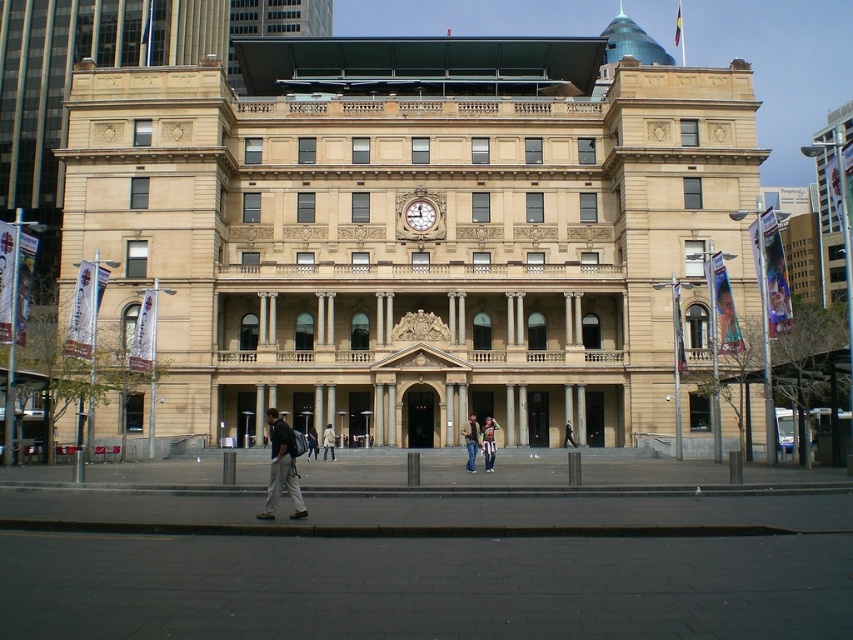
Question: In this image, where is dark gray fabric pants at lower left located relative to striped fabric pants at center?

Choices:
 (A) above
 (B) below

Answer: (A)

Question: Which point is closer to the camera?

Choices:
 (A) dark suit at center
 (B) shiny glass dome at upper center
 (C) striped fabric pants at center
 (D) gold metallic clock at center

Answer: (C)

Question: Which of the following is the farthest from the observer?

Choices:
 (A) denim jacket at center
 (B) light brown leather jacket at center

Answer: (B)

Question: Which object appears farthest from the camera in this image?

Choices:
 (A) striped fabric pants at center
 (B) dark gray fabric pants at lower left

Answer: (A)

Question: Is gold metallic clock at center to the right of dark blue jeans at center from the viewer's perspective?

Choices:
 (A) no
 (B) yes

Answer: (B)

Question: Can you confirm if shiny glass dome at upper center is bigger than light brown leather jacket at center?

Choices:
 (A) yes
 (B) no

Answer: (A)